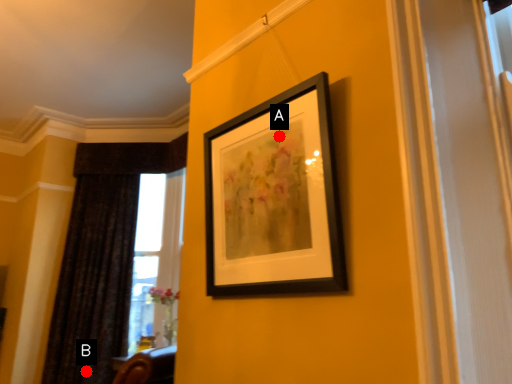
Question: Two points are circled on the image, labeled by A and B beside each circle. Which point is closer to the camera taking this photo?

Choices:
 (A) A is closer
 (B) B is closer

Answer: (A)